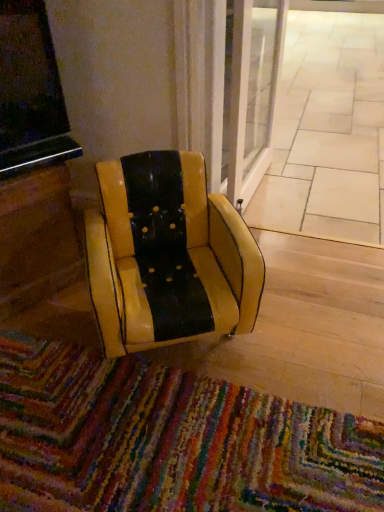
Question: Should I look upward or downward to see multicolored woven mat at lower center?

Choices:
 (A) down
 (B) up

Answer: (A)

Question: Considering the relative sizes of yellow leather chair at center and multicolored woven mat at lower center in the image provided, is yellow leather chair at center shorter than multicolored woven mat at lower center?

Choices:
 (A) no
 (B) yes

Answer: (A)

Question: Does yellow leather chair at center have a greater height compared to multicolored woven mat at lower center?

Choices:
 (A) no
 (B) yes

Answer: (B)

Question: Is yellow leather chair at center facing towards multicolored woven mat at lower center?

Choices:
 (A) no
 (B) yes

Answer: (B)

Question: Can you confirm if yellow leather chair at center is smaller than multicolored woven mat at lower center?

Choices:
 (A) no
 (B) yes

Answer: (A)

Question: From the image's perspective, is yellow leather chair at center above multicolored woven mat at lower center?

Choices:
 (A) yes
 (B) no

Answer: (A)

Question: Can multicolored woven mat at lower center be found inside yellow leather chair at center?

Choices:
 (A) yes
 (B) no

Answer: (B)

Question: From the image's perspective, does beige tile pavement at center appear lower than multicolored woven mat at lower center?

Choices:
 (A) yes
 (B) no

Answer: (B)

Question: Is beige tile pavement at center closer to the viewer compared to multicolored woven mat at lower center?

Choices:
 (A) yes
 (B) no

Answer: (B)

Question: Is beige tile pavement at center surrounding multicolored woven mat at lower center?

Choices:
 (A) no
 (B) yes

Answer: (A)

Question: From a real-world perspective, is beige tile pavement at center on top of multicolored woven mat at lower center?

Choices:
 (A) yes
 (B) no

Answer: (B)

Question: Does beige tile pavement at center have a greater width compared to multicolored woven mat at lower center?

Choices:
 (A) no
 (B) yes

Answer: (B)

Question: Is beige tile pavement at center not inside multicolored woven mat at lower center?

Choices:
 (A) yes
 (B) no

Answer: (A)

Question: Is multicolored woven mat at lower center looking in the opposite direction of beige tile pavement at center?

Choices:
 (A) no
 (B) yes

Answer: (A)